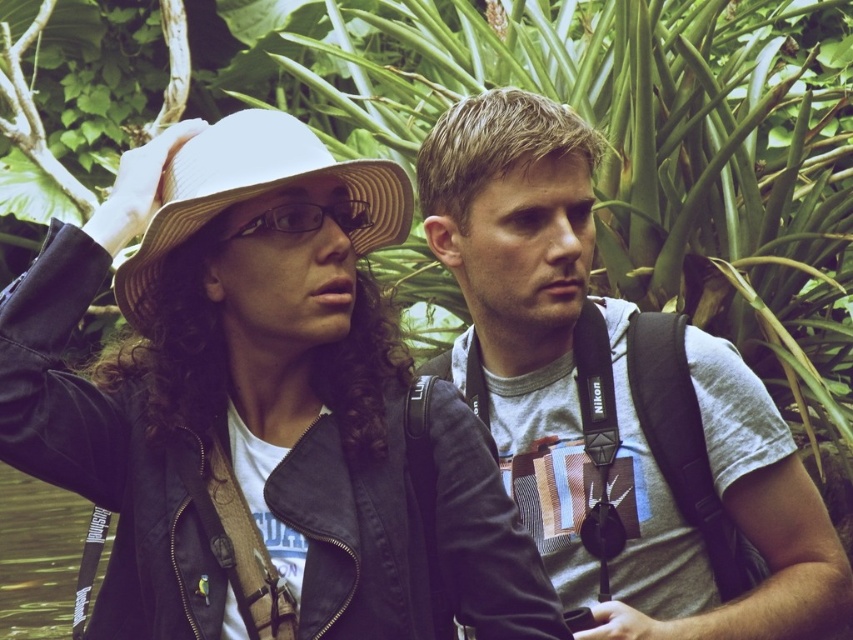
Between matte white hat at left and gray cotton t-shirt at center, which one is positioned lower?

gray cotton t-shirt at center is lower down.

Does point (24, 419) come in front of point (556, 120)?

Yes, it is in front of point (556, 120).

This screenshot has width=853, height=640. Identify the location of matte white hat at left. (230, 381).

What do you see at coordinates (230, 381) in the screenshot? This screenshot has width=853, height=640. I see `matte white hat at left` at bounding box center [230, 381].

Does matte white hat at left appear on the left side of transparent plastic water at lower left?

No, matte white hat at left is not to the left of transparent plastic water at lower left.

Does point (71, 394) come behind point (80, 534)?

That is False.

Where is `matte white hat at left`? The image size is (853, 640). matte white hat at left is located at coordinates (230, 381).

Which of these two, gray cotton t-shirt at center or transparent plastic water at lower left, stands taller?

gray cotton t-shirt at center

Identify the location of gray cotton t-shirt at center. (614, 403).